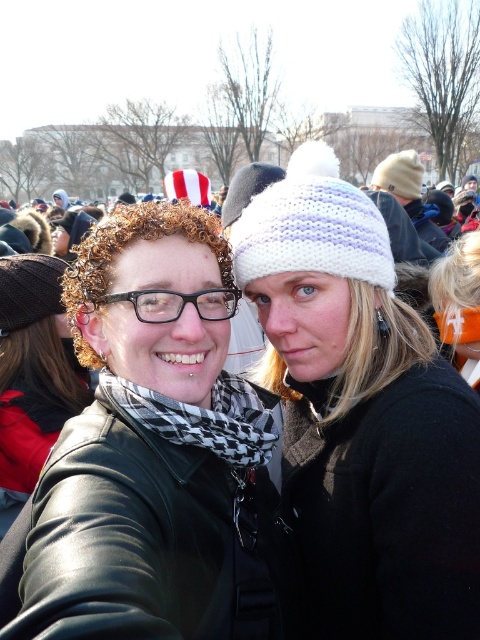
You are a photographer trying to capture a clear shot of the matte black jacket at center and the blonde hair at center. Based on their positions, which object should you focus on first to ensure both are in frame?

The matte black jacket at center has a greater height compared to blonde hair at center, so you should focus on the matte black jacket at center first to ensure both are in frame.

You are a photographer trying to capture a clear shot of the blonde hair at center and the white knitted hat at upper center. Based on their heights in the scene, which object should you focus on first to ensure both are in frame?

The blonde hair at center is shorter than the white knitted hat at upper center, so you should focus on the white knitted hat at upper center first to ensure both are in frame.